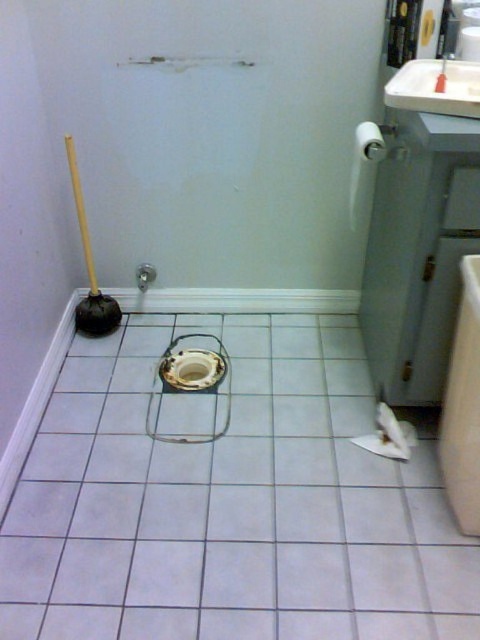
Question: Which of the following is the closest to the observer?

Choices:
 (A) matte black plunger at center-left
 (B) white glossy sink at lower right

Answer: (B)

Question: Does white glossy sink at lower right appear under white glossy sink at upper right?

Choices:
 (A) no
 (B) yes

Answer: (B)

Question: Is white glossy sink at lower right to the right of white glossy sink at upper right from the viewer's perspective?

Choices:
 (A) yes
 (B) no

Answer: (A)

Question: Does white glossy sink at lower right lie in front of matte black plunger at center-left?

Choices:
 (A) no
 (B) yes

Answer: (B)

Question: Based on their relative distances, which object is nearer to the white glossy sink at lower right?

Choices:
 (A) matte black plunger at center-left
 (B) white glossy sink at upper right

Answer: (B)

Question: Which object is positioned farthest from the white glossy sink at upper right?

Choices:
 (A) matte black plunger at center-left
 (B) white glossy sink at lower right

Answer: (B)